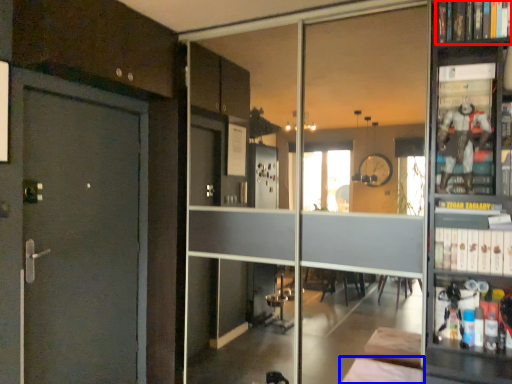
Question: Which point is further to the camera, book (highlighted by a red box) or furniture (highlighted by a blue box)?

Choices:
 (A) book
 (B) furniture

Answer: (A)